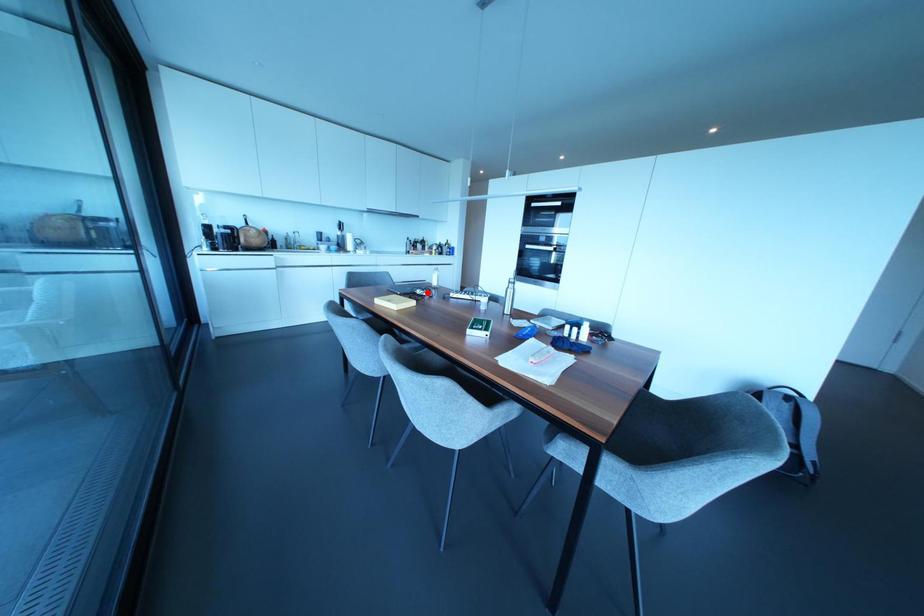
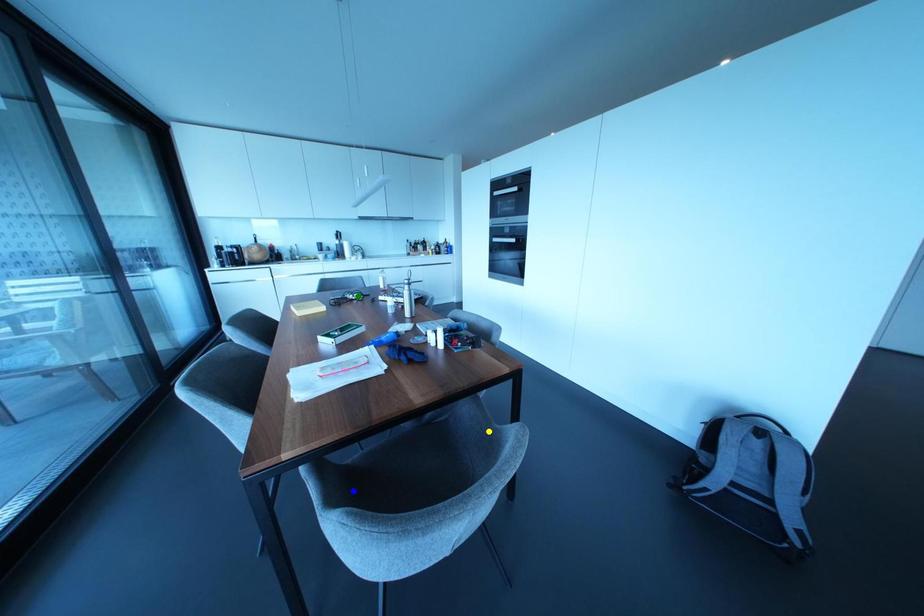
Question: I am providing you with two images of the same scene from different viewpoints. A red point is marked on the first image. You are given multiple points on the second image. Which spot in image 2 lines up with the point in image 1?

Choices:
 (A) green point
 (B) yellow point
 (C) blue point

Answer: (A)